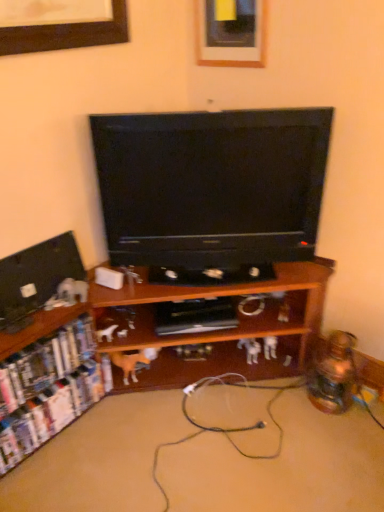
I want to click on free space between white cardboard shelf at lower left, the first shelf positioned from the left, and black rubber extension cord at lower center, so click(112, 423).